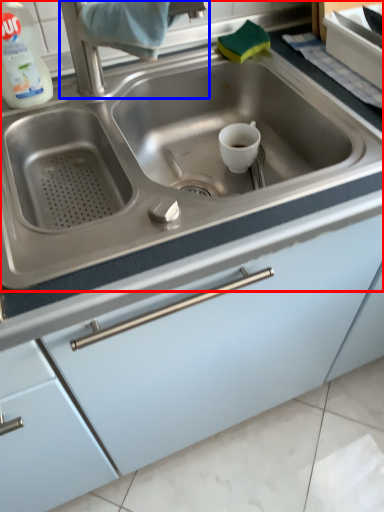
Question: Which object appears closest to the camera in this image, sink (highlighted by a red box) or faucet (highlighted by a blue box)?

Choices:
 (A) sink
 (B) faucet

Answer: (A)